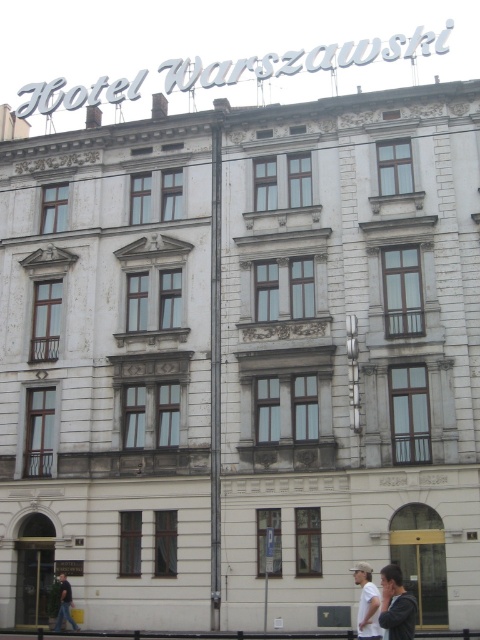
Question: Does dark gray hoodie at center appear on the right side of dark gray cotton shirt at lower left?

Choices:
 (A) yes
 (B) no

Answer: (A)

Question: Which point appears closest to the camera in this image?

Choices:
 (A) (397, 568)
 (B) (359, 576)

Answer: (A)

Question: Where is white cotton shirt at lower right located in relation to dark gray cotton shirt at lower left in the image?

Choices:
 (A) left
 (B) right

Answer: (B)

Question: Which object is the closest to the dark gray cotton shirt at lower left?

Choices:
 (A) dark gray hoodie at center
 (B) white cotton shirt at lower right

Answer: (B)

Question: Which of the following is the closest to the observer?

Choices:
 (A) (70, 621)
 (B) (371, 573)

Answer: (B)

Question: Does dark gray hoodie at center have a lesser width compared to dark gray cotton shirt at lower left?

Choices:
 (A) no
 (B) yes

Answer: (A)